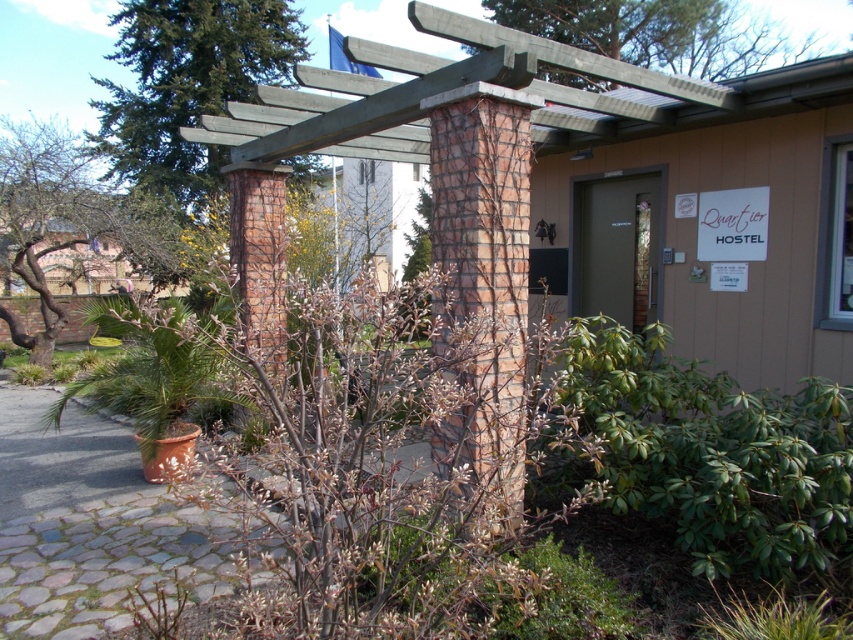
Consider the image. Does green textured tree at upper left have a larger size compared to green leafy tree at upper center?

No.

Who is lower down, green textured tree at upper left or green leafy tree at upper center?

Positioned lower is green textured tree at upper left.

This screenshot has height=640, width=853. Find the location of `green textured tree at upper left`. green textured tree at upper left is located at coordinates (189, 84).

I want to click on green textured tree at upper left, so click(x=189, y=84).

How far apart are green textured tree at upper left and green leafy tree at left?

They are 4.65 meters apart.

Is green textured tree at upper left below green leafy tree at left?

No, green textured tree at upper left is not below green leafy tree at left.

Does point (216, 154) lie behind point (44, 273)?

Yes, it is behind point (44, 273).

Where is `green textured tree at upper left`? This screenshot has width=853, height=640. green textured tree at upper left is located at coordinates (189, 84).

Is point (146, 502) in front of point (258, 28)?

Yes, point (146, 502) is in front of point (258, 28).

Who is more distant from viewer, (94, 500) or (163, 68)?

Positioned behind is point (163, 68).

I want to click on brown cobblestone path at center, so click(x=86, y=524).